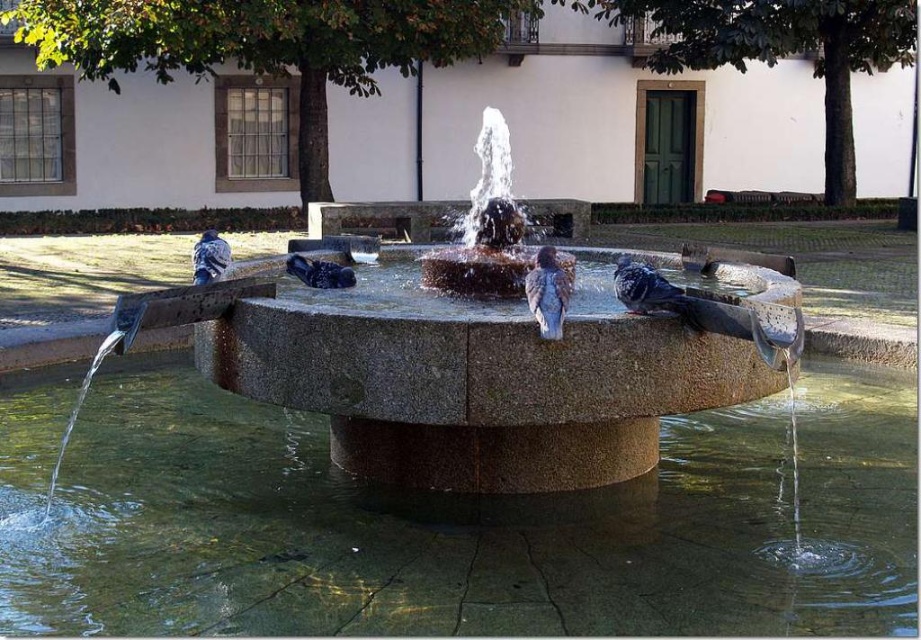
Can you confirm if gray matte pigeon at center is shorter than blue-gray feathers at left?

Yes.

Is gray matte pigeon at center positioned before blue-gray feathers at left?

Yes, gray matte pigeon at center is in front of blue-gray feathers at left.

Describe the element at coordinates (646, 289) in the screenshot. I see `gray matte pigeon at center` at that location.

At what (x,y) coordinates should I click in order to perform the action: click on gray matte pigeon at center. Please return your answer as a coordinate pair (x, y). This screenshot has width=921, height=640. Looking at the image, I should click on (646, 289).

Find the location of `clear water at fountain center`. clear water at fountain center is located at coordinates (450, 524).

Is clear water at fountain center shorter than brown speckled feathers at center?

Yes.

Who is more forward, (383, 513) or (537, 324)?

Point (537, 324) is in front.

You are a GUI agent. You are given a task and a screenshot of the screen. Output one action in this format:
    pyautogui.click(x=<x>, y=<y>)
    Task: Click on the clear water at fountain center
    
    Given the screenshot: What is the action you would take?
    pyautogui.click(x=450, y=524)

Locate an element on the screen. This screenshot has width=921, height=640. clear water at fountain center is located at coordinates (450, 524).

Does point (290, 582) lie behind point (648, 268)?

No.

Who is more forward, (122, 604) or (616, 262)?

Point (122, 604)

Locate an element on the screen. clear water at fountain center is located at coordinates (450, 524).